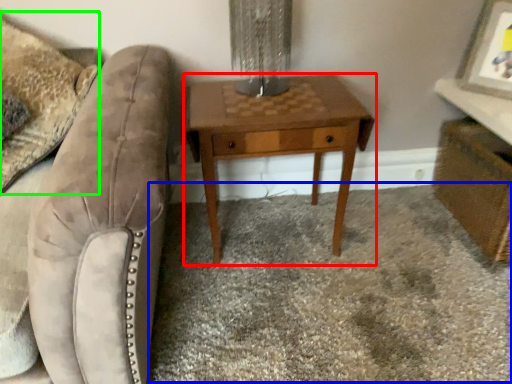
Question: Estimate the real-world distances between objects in this image. Which object is closer to nightstand (highlighted by a red box), plain (highlighted by a blue box) or throw pillow (highlighted by a green box)?

Choices:
 (A) plain
 (B) throw pillow

Answer: (A)